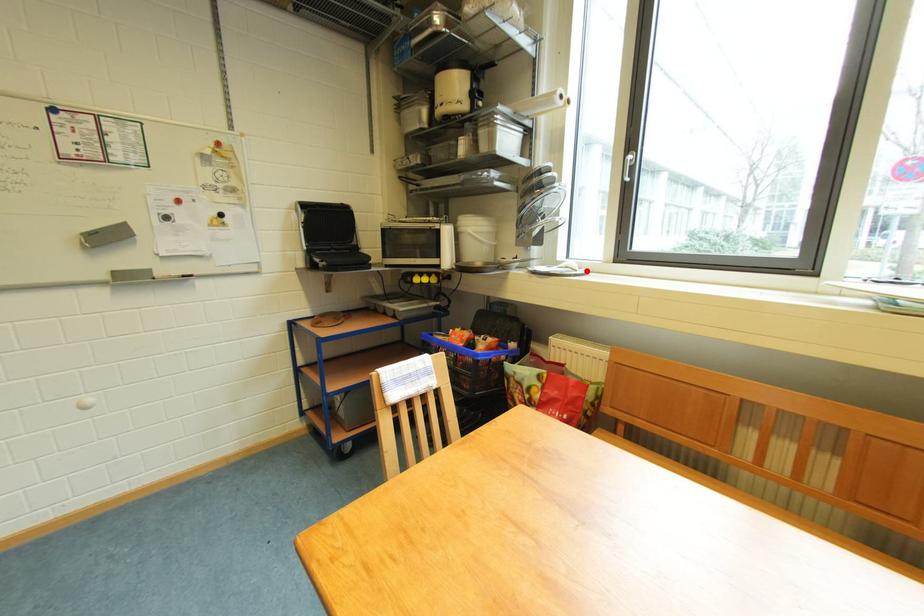
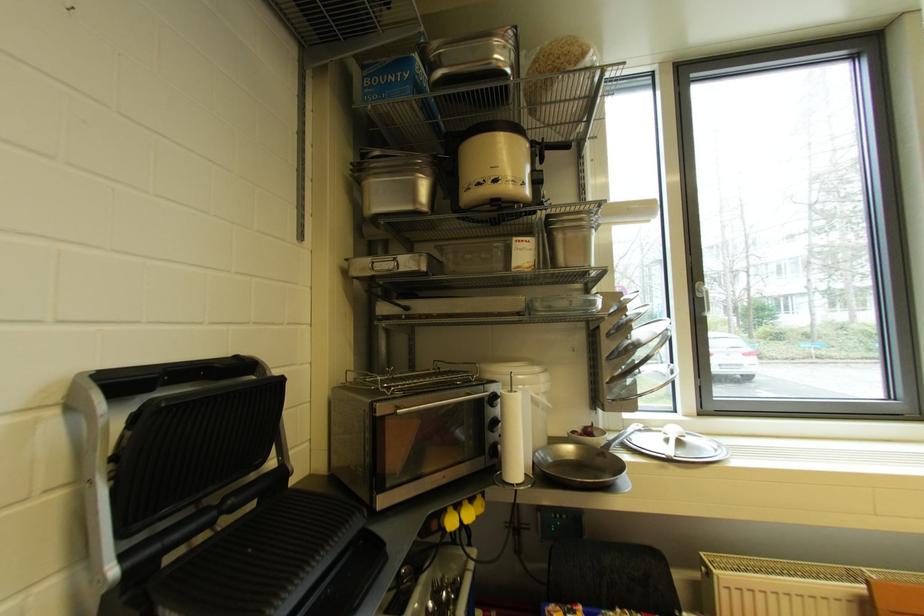
Find the pixel in the second image that matches the highlighted location in the first image.

(695, 437)